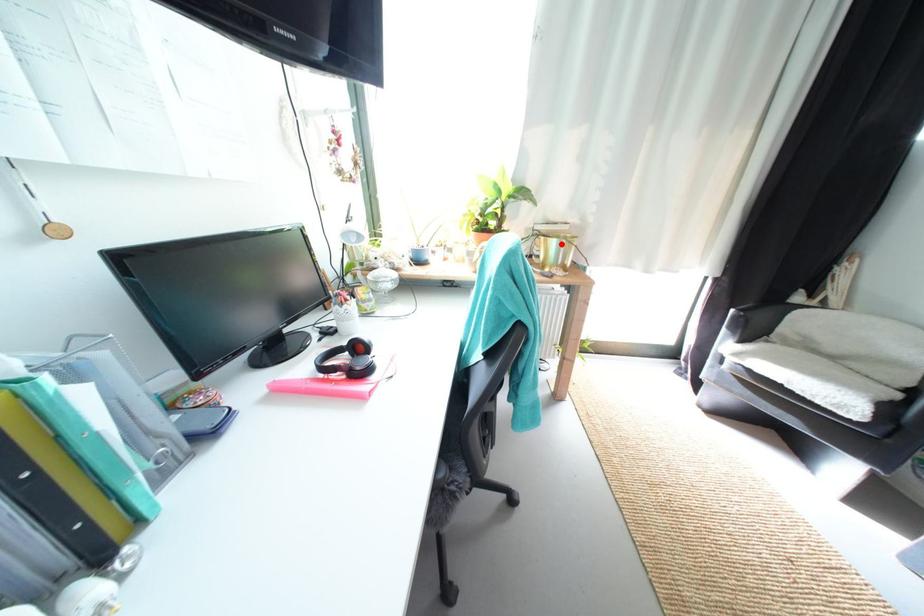
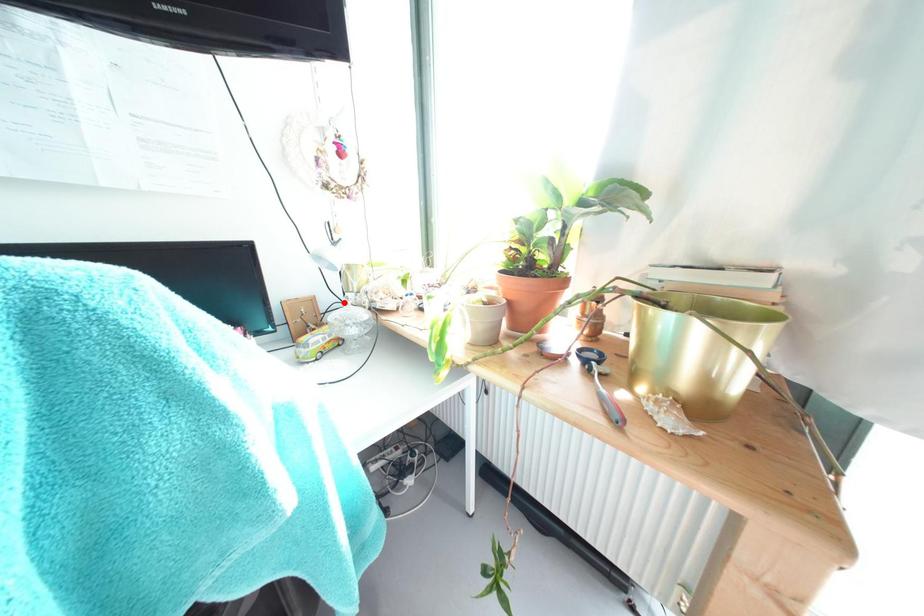
I am providing you with two images of the same scene from different viewpoints. A red point is marked on the first image and another point is marked on the second image. Does the point marked in image1 correspond to the same location as the one in image2?

No